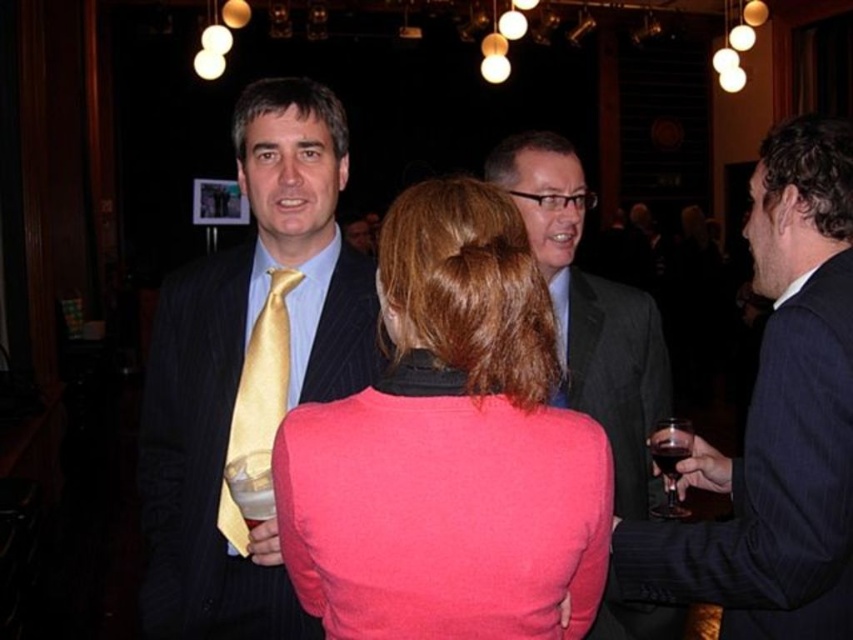
You are a photographer at the event and want to capture a photo of the pinstriped suit at center and the gold satin tie at center. Based on their positions, which one should you focus on first to ensure both are in sharp focus?

The pinstriped suit at center is above the gold satin tie at center, so you should focus on the gold satin tie at center first since it is closer to the camera. This way, when adjusting focus upwards, both will be in sharp focus.

You are at the entrance of the room and want to find the matte pink sweater at center. According to the coordinates provided, in which direction should you look to locate it?

→ The matte pink sweater at center is located at point coordinates (450, 449). Since the x coordinate is 0.703 which is greater than 0.5, it is to the right of the center. The y coordinate is 0.528, slightly above the center. So you should look to your right and slightly upwards from the center point to locate the matte pink sweater at center.